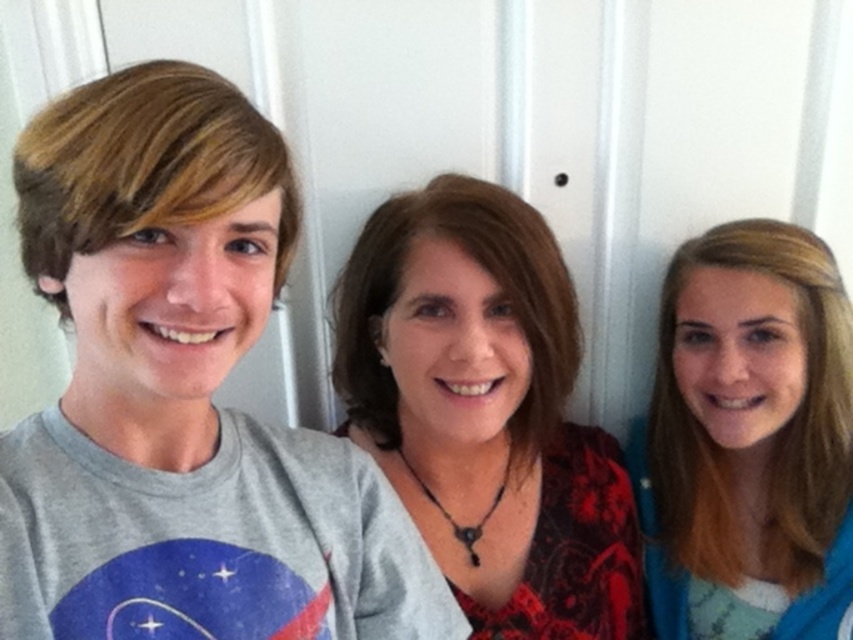
Does gray cotton t-shirt at left have a lesser height compared to matte red blouse at center?

Yes.

Which is below, gray cotton t-shirt at left or matte red blouse at center?

matte red blouse at center is below.

The image size is (853, 640). Find the location of `gray cotton t-shirt at left`. gray cotton t-shirt at left is located at coordinates (183, 396).

Is matte red blouse at center shorter than blonde hair at right?

In fact, matte red blouse at center may be taller than blonde hair at right.

Can you confirm if matte red blouse at center is bigger than blonde hair at right?

Yes.

Who is more distant from viewer, (514, 532) or (677, 564)?

Point (677, 564)

The width and height of the screenshot is (853, 640). I want to click on matte red blouse at center, so click(x=486, y=412).

Who is shorter, gray cotton t-shirt at left or blonde hair at right?

gray cotton t-shirt at left

Between gray cotton t-shirt at left and blonde hair at right, which one appears on the right side from the viewer's perspective?

Positioned to the right is blonde hair at right.

The height and width of the screenshot is (640, 853). I want to click on gray cotton t-shirt at left, so click(x=183, y=396).

The height and width of the screenshot is (640, 853). What are the coordinates of `gray cotton t-shirt at left` in the screenshot? It's located at (183, 396).